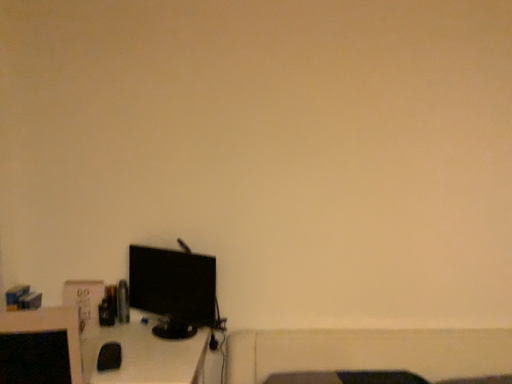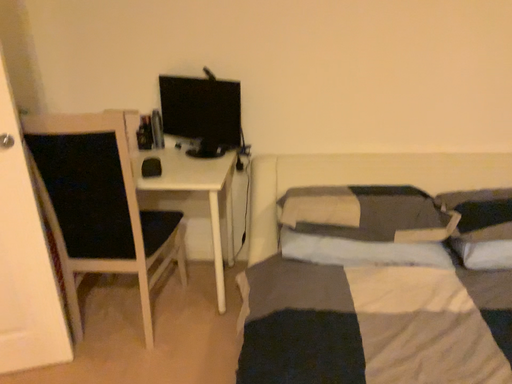
Question: How did the camera likely rotate when shooting the video?

Choices:
 (A) rotated downward
 (B) rotated upward

Answer: (A)